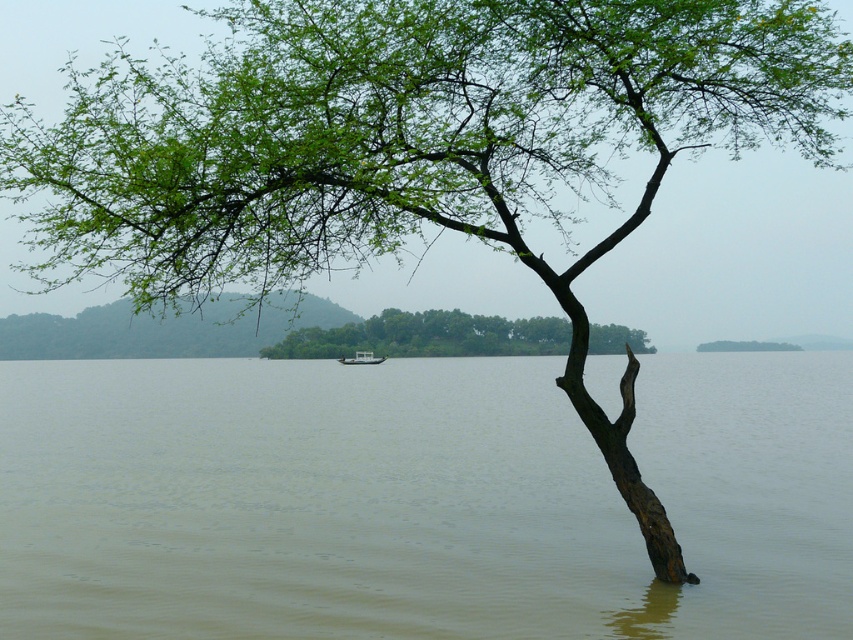
Question: Among these points, which one is nearest to the camera?

Choices:
 (A) (634, 540)
 (B) (622, 349)
 (C) (337, 358)
 (D) (782, 340)

Answer: (A)

Question: Which object is closer to the camera taking this photo?

Choices:
 (A) green leafy tree at center
 (B) brown murky water at center
 (C) brown rough tree trunk at center

Answer: (B)

Question: Can you confirm if brown rough tree trunk at center is smaller than white matte boat at center?

Choices:
 (A) no
 (B) yes

Answer: (A)

Question: Which object is closer to the camera taking this photo?

Choices:
 (A) green leafy tree at center
 (B) brown rough tree trunk at center
 (C) brown murky water at center
 (D) white matte boat at center

Answer: (C)

Question: Does green leafy tree at center have a smaller size compared to white matte boat at center?

Choices:
 (A) yes
 (B) no

Answer: (B)

Question: Is brown murky water at center below green leafy tree at center?

Choices:
 (A) no
 (B) yes

Answer: (B)